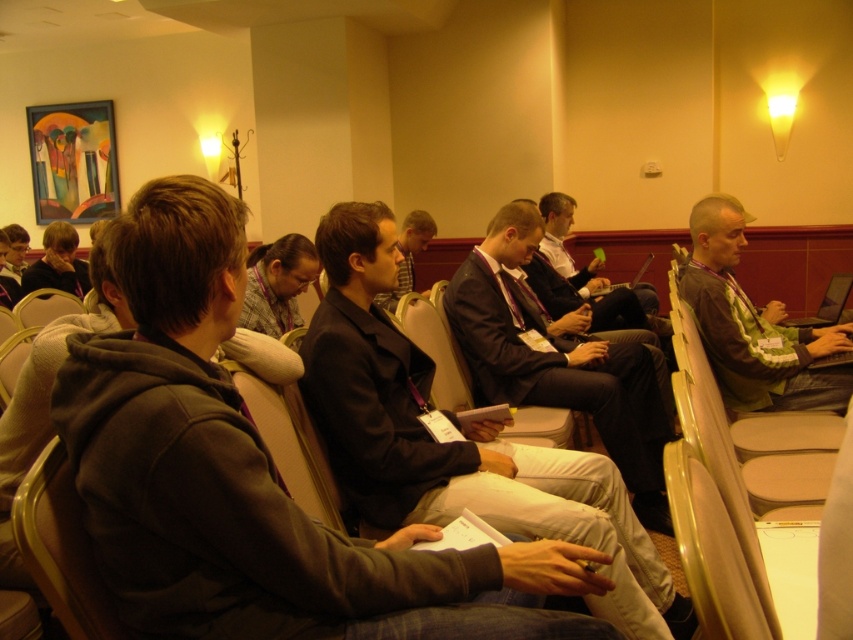
Question: Does dark gray hoodie at center have a greater width compared to dark suit jacket at center?

Choices:
 (A) yes
 (B) no

Answer: (B)

Question: Can you confirm if dark suit at center is positioned below green fabric shirt at right?

Choices:
 (A) yes
 (B) no

Answer: (A)

Question: Which point is closer to the camera taking this photo?

Choices:
 (A) (422, 234)
 (B) (547, 451)
 (C) (490, 387)
 (D) (253, 593)

Answer: (D)

Question: Can you confirm if dark gray suit at center is smaller than light brown leather chair at left?

Choices:
 (A) no
 (B) yes

Answer: (A)

Question: Among these objects, which one is nearest to the camera?

Choices:
 (A) dark gray suit at center
 (B) green fabric shirt at right
 (C) dark suit at center
 (D) dark gray hoodie at center

Answer: (D)

Question: Which of the following is the farthest from the observer?

Choices:
 (A) dark gray hoodie at center
 (B) dark gray suit at center

Answer: (B)